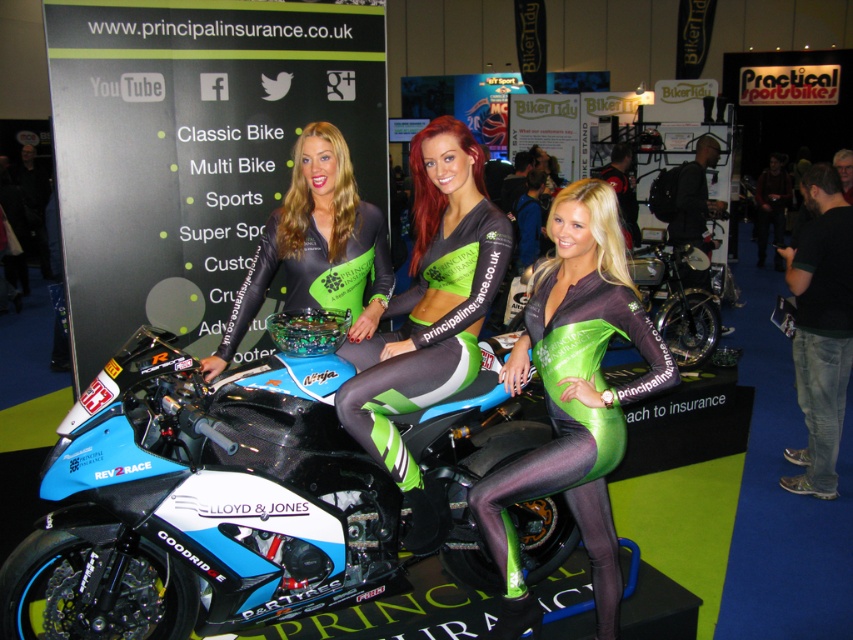
What is the 2D coordinate of the blue carbon fiber motorcycle at center in the image?

The blue carbon fiber motorcycle at center is located at the 2D coordinate point of (x=202, y=504).

You are a photographer at the event and want to ensure both the green shiny bodysuit at center and the green matte jersey at center are visible in your photo. Which one is closer to the camera?

The green shiny bodysuit at center is in front of the green matte jersey at center, so it is closer to the camera.